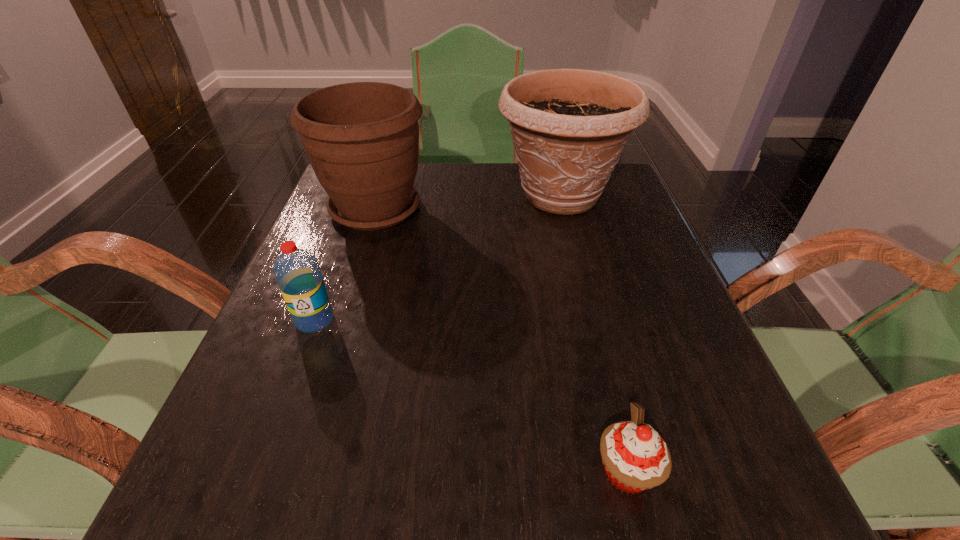
Locate an element on the screen. This screenshot has width=960, height=540. vacant region between the water bottle and the left flowerpot is located at coordinates (345, 265).

Find the location of a particular element. Image resolution: width=960 pixels, height=540 pixels. empty location between the water bottle and the cupcake is located at coordinates (470, 395).

Where is `empty space that is in between the left flowerpot and the right flowerpot`? empty space that is in between the left flowerpot and the right flowerpot is located at coordinates (468, 202).

At what (x,y) coordinates should I click in order to perform the action: click on free spot between the right flowerpot and the nearest object. Please return your answer as a coordinate pair (x, y). Looking at the image, I should click on (593, 333).

The width and height of the screenshot is (960, 540). What are the coordinates of `object that ranks as the second closest to the right flowerpot` in the screenshot? It's located at (297, 272).

Find the location of `the third closest object relative to the right flowerpot`. the third closest object relative to the right flowerpot is located at coordinates (635, 457).

Where is `vacant area that satisfies the following two spatial constraints: 1. on the back side of the cupcake; 2. on the left side of the right flowerpot`? vacant area that satisfies the following two spatial constraints: 1. on the back side of the cupcake; 2. on the left side of the right flowerpot is located at coordinates (558, 195).

Find the location of a particular element. blank space that satisfies the following two spatial constraints: 1. on the front label of the cupcake; 2. on the left side of the third farthest object is located at coordinates (258, 471).

The width and height of the screenshot is (960, 540). I want to click on free space that satisfies the following two spatial constraints: 1. on the front side of the left flowerpot; 2. on the left side of the nearest object, so click(292, 471).

Where is `free location that satisfies the following two spatial constraints: 1. on the front label of the shortest object; 2. on the right side of the second shortest object`? This screenshot has width=960, height=540. free location that satisfies the following two spatial constraints: 1. on the front label of the shortest object; 2. on the right side of the second shortest object is located at coordinates (258, 471).